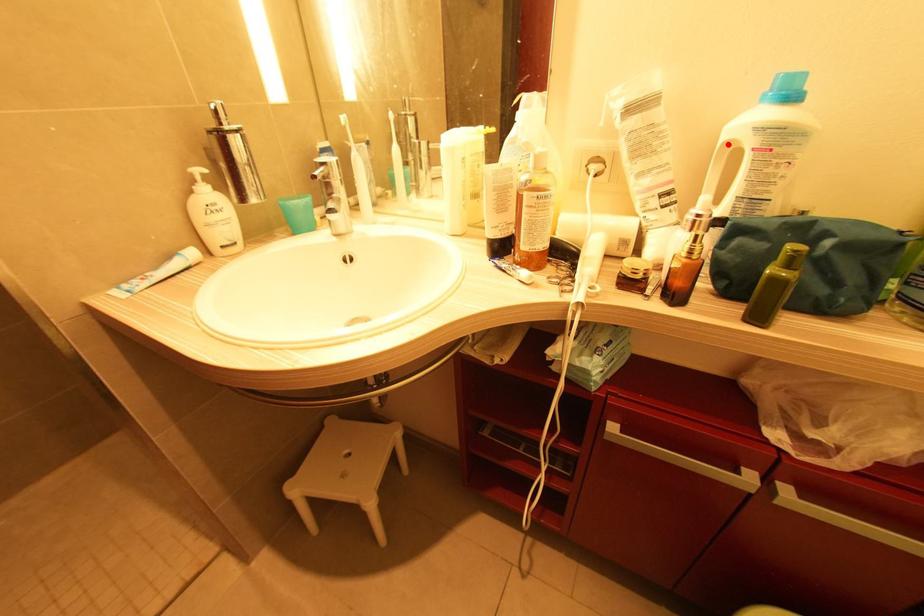
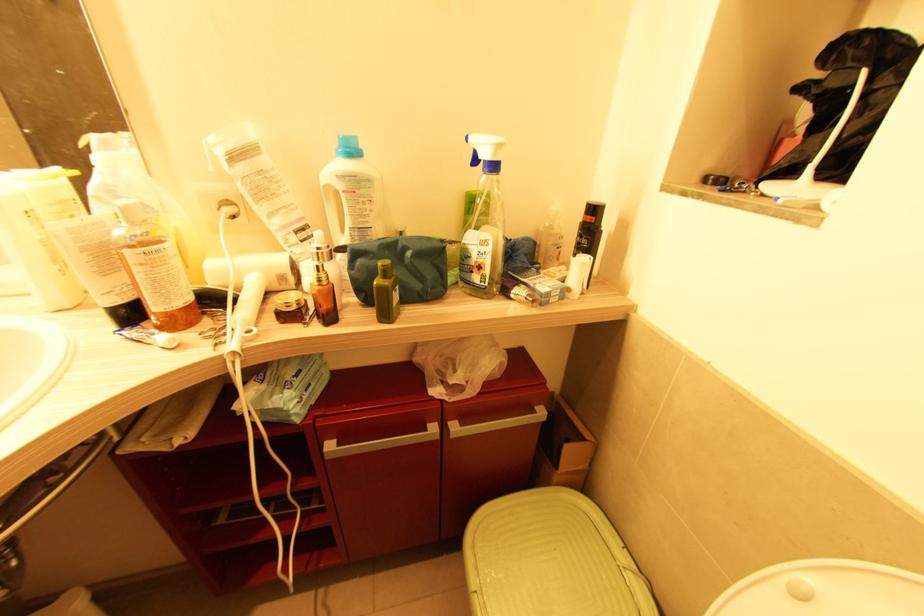
In the second image, find the point that corresponds to the highlighted location in the first image.

(329, 188)